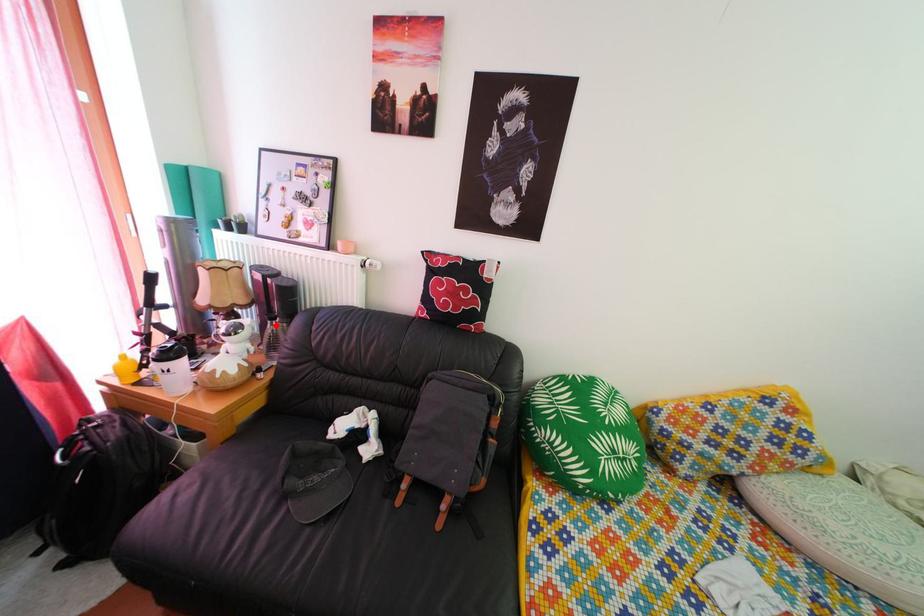
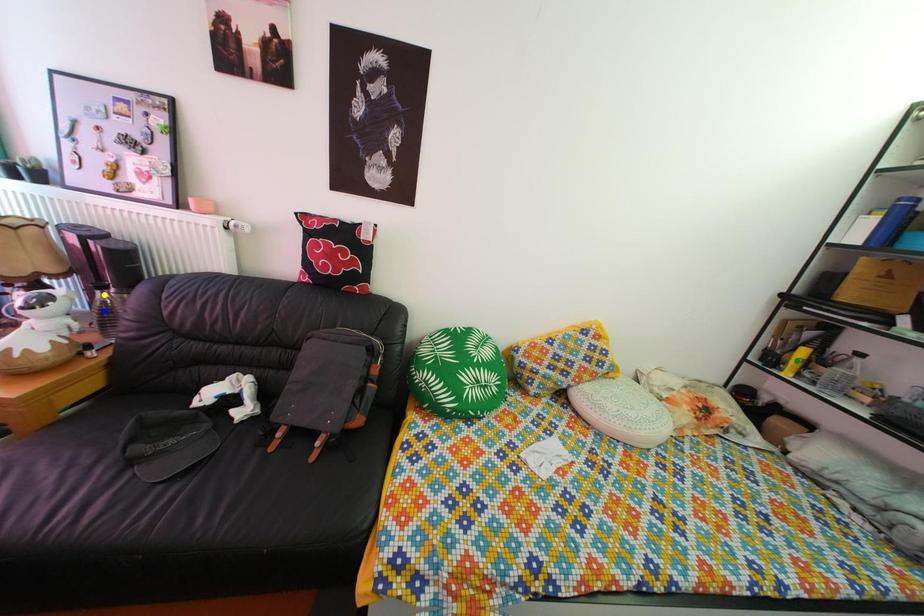
Question: I am providing you with two images of the same scene from different viewpoints. A red point is marked on the first image. You are given multiple points on the second image. Which mark in image 2 goes with the point in image 1?

Choices:
 (A) green point
 (B) blue point
 (C) yellow point

Answer: (C)